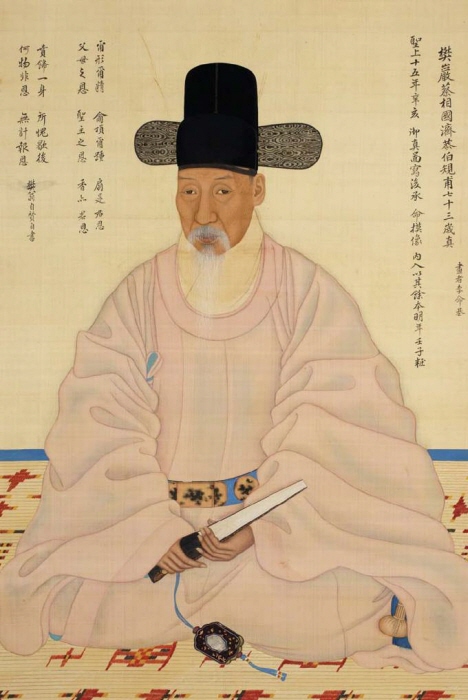
Image resolution: width=468 pixels, height=700 pixels. Identify the location of robe. (224, 336).